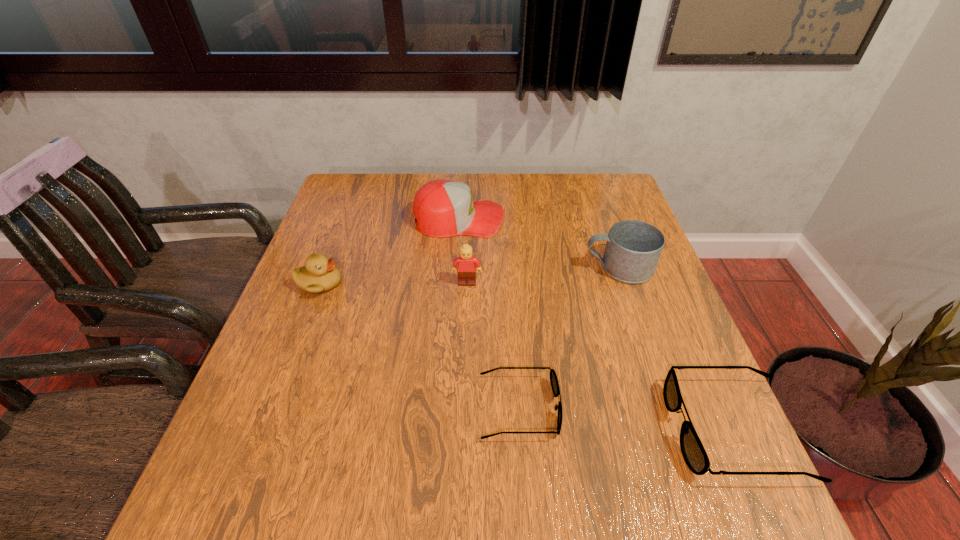
Identify the location of vacant region located on the front-facing side of the fifth tallest object. tap(553, 429).

Locate an element on the screen. The height and width of the screenshot is (540, 960). free space located on the front-facing side of the fifth tallest object is located at coordinates (586, 429).

This screenshot has width=960, height=540. I want to click on vacant area situated on the front-facing side of the baseball cap, so click(609, 219).

Find the location of a particular element. vacant area situated 0.190m on the face of the Lego is located at coordinates (465, 348).

I want to click on free location located at the beak of the leftmost object, so click(467, 284).

I want to click on vacant space located 0.160m on the side of the mug with the handle, so click(522, 267).

Image resolution: width=960 pixels, height=540 pixels. Find the location of `vacant space positioned 0.390m on the side of the mug with the handle`. vacant space positioned 0.390m on the side of the mug with the handle is located at coordinates (434, 267).

Locate an element on the screen. The image size is (960, 540). vacant space situated 0.300m on the side of the mug with the handle is located at coordinates (468, 267).

At what (x,y) coordinates should I click in order to perform the action: click on object present at the far edge. Please return your answer as a coordinate pair (x, y). The height and width of the screenshot is (540, 960). Looking at the image, I should click on (443, 208).

At what (x,y) coordinates should I click in order to perform the action: click on object that is at the left edge. Please return your answer as a coordinate pair (x, y). This screenshot has height=540, width=960. Looking at the image, I should click on (319, 275).